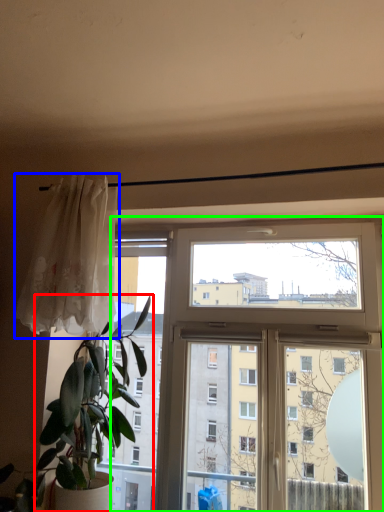
Question: Which is nearer to the houseplant (highlighted by a red box)? curtain (highlighted by a blue box) or window (highlighted by a green box).

Choices:
 (A) curtain
 (B) window

Answer: (A)